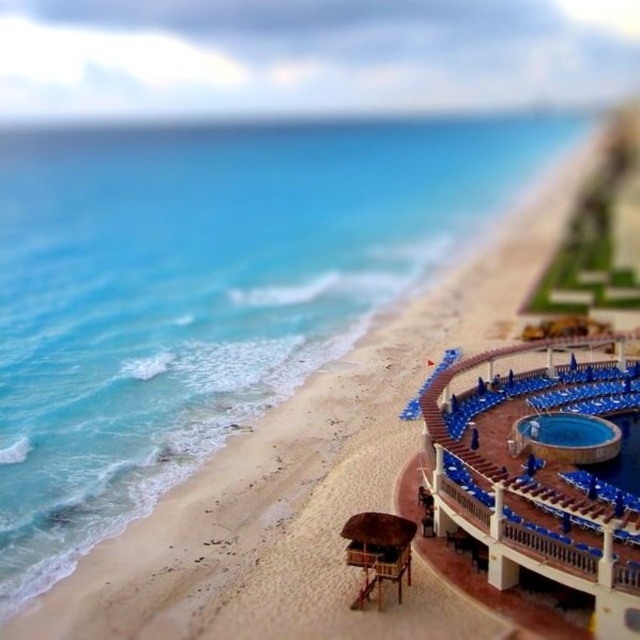
From the picture: Does blue plastic lounge chairs at lower right have a smaller size compared to blue glossy pool at lower right?

No, blue plastic lounge chairs at lower right is not smaller than blue glossy pool at lower right.

Locate an element on the screen. This screenshot has height=640, width=640. blue plastic lounge chairs at lower right is located at coordinates (536, 476).

Which is below, blue plastic lounge chairs at lower right or blue glossy pool at center right?

blue glossy pool at center right is lower down.

Does blue plastic lounge chairs at lower right appear under blue glossy pool at center right?

Actually, blue plastic lounge chairs at lower right is above blue glossy pool at center right.

Does point (620, 378) lie in front of point (621, 445)?

No.

This screenshot has width=640, height=640. I want to click on blue plastic lounge chairs at lower right, so click(x=536, y=476).

Is point (545, 440) less distant than point (602, 476)?

No, (545, 440) is further to viewer.

This screenshot has width=640, height=640. What are the coordinates of `blue glossy pool at lower right` in the screenshot? It's located at (564, 432).

Locate an element on the screen. blue glossy pool at lower right is located at coordinates (564, 432).